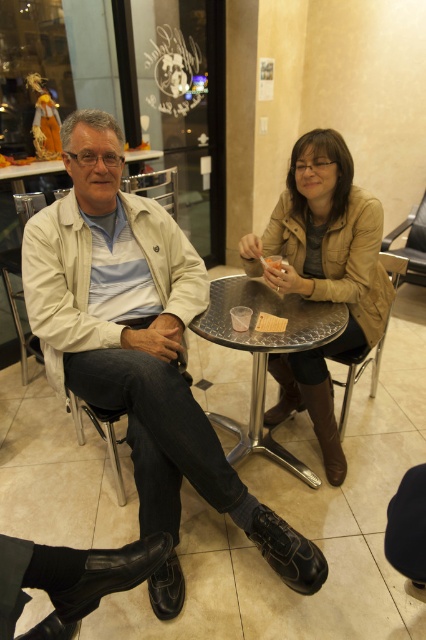
Question: Which point is farther from the camera taking this photo?

Choices:
 (A) (425, 284)
 (B) (267, 444)

Answer: (A)

Question: Does matte beige jacket at left have a greater width compared to black leather shoe at lower left?

Choices:
 (A) no
 (B) yes

Answer: (B)

Question: Does brown leather chair at center have a smaller size compared to metallic silver chair at center?

Choices:
 (A) no
 (B) yes

Answer: (A)

Question: Which object is positioned farthest from the black leather shoe at lower left?

Choices:
 (A) brown leather chair at center
 (B) metallic silver chair at center
 (C) translucent plastic cup at table center

Answer: (B)

Question: Considering the relative positions of metallic textured table at center and leather-like brown chair at right in the image provided, where is metallic textured table at center located with respect to leather-like brown chair at right?

Choices:
 (A) below
 (B) above

Answer: (A)

Question: Which point is closer to the camera taking this photo?

Choices:
 (A) (114, 436)
 (B) (22, 600)
 (C) (57, 228)
 (D) (262, 312)

Answer: (B)